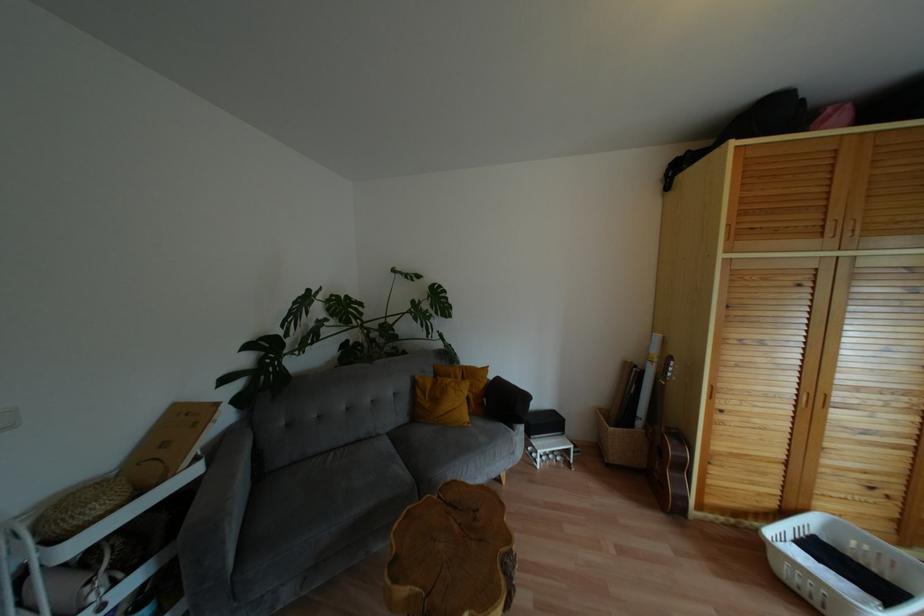
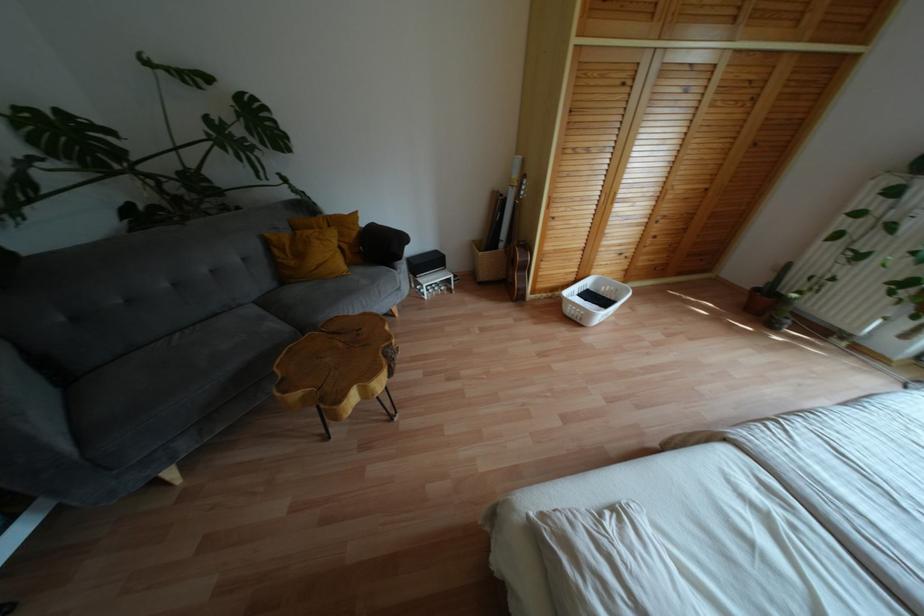
Find the pixel in the second image that matches the point at 439,286 in the first image.

(253, 98)